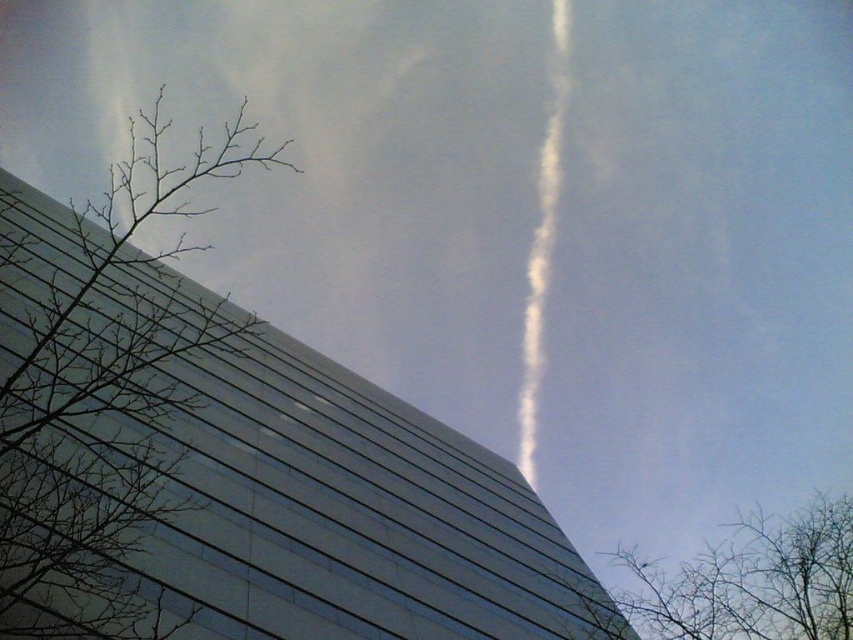
You are standing in front of the modern building and notice two points marked on the facade. The first point is at coordinates point (102, 627) and the second is at point (804, 548). Which point is nearer to your position?

The point at point (102, 627) is closer to the viewer than point (804, 548).

You are standing in front of the modern building and notice the bare branches at left and the white fluffy smoke at upper center. Which of these two objects appears wider in the scene?

The bare branches at left appear wider than the white fluffy smoke at upper center because their width is larger according to the description.

From the picture: You are standing in front of the modern building and notice two points marked on the image. The first point is at coordinates point (36, 342) and the second is at point (561, 16). Which of these two points is closer to you?

Point (36, 342) is closer to the viewer than point (561, 16).